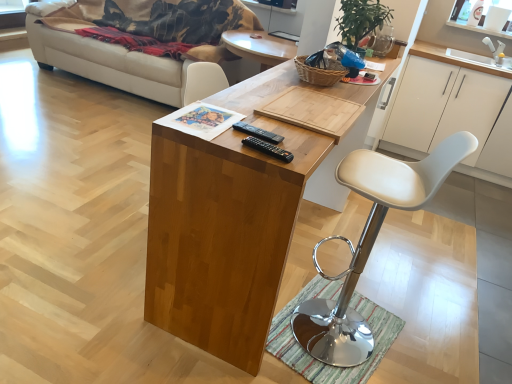
The height and width of the screenshot is (384, 512). Find the location of `vacant space behind black plastic remote at center, arranged as the 2th remote when viewed from the front`. vacant space behind black plastic remote at center, arranged as the 2th remote when viewed from the front is located at coordinates (254, 115).